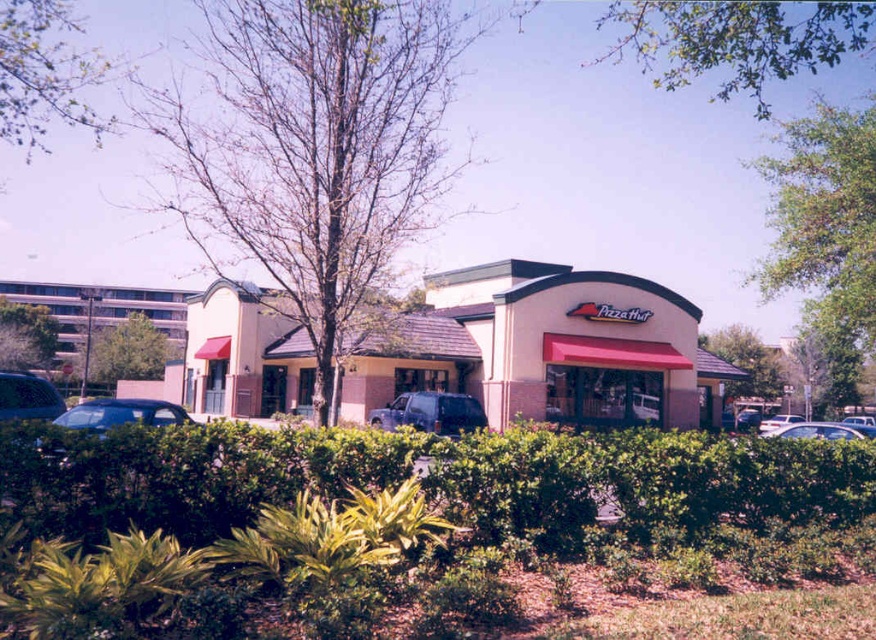
You are a delivery driver who needs to park your satin black suv at center in the parking lot near the beige stucco pizza hut at center. Considering the size of the parking spaces, can your suv fit next to the pizza hut without overlapping?

The beige stucco pizza hut at center is wider than the satin black suv at center. Since the parking spaces are typically designed to accommodate vehicles, the suv should fit as long as it is parked within the designated space, not overlapping the building itself.

You are a delivery driver who needs to park your vehicle in the parking lot of the Pizza Hut restaurant. You see a satin black suv at center and a white matte car at center. Which vehicle should you avoid parking to the right of if you want to stay aligned with the hedge?

You should avoid parking to the right of the satin black suv at center because it is already positioned to the left of the white matte car at center, so parking to its right would place you closer to the hedge bordering the parking lot.

Looking at this image, you are a customer arriving at the Pizza Hut and need to park your car. You see the beige stucco pizza hut at center and the satin black suv at center. Which one is closer to you?

The beige stucco pizza hut at center is closer to you since it is positioned in front of the satin black suv at center.